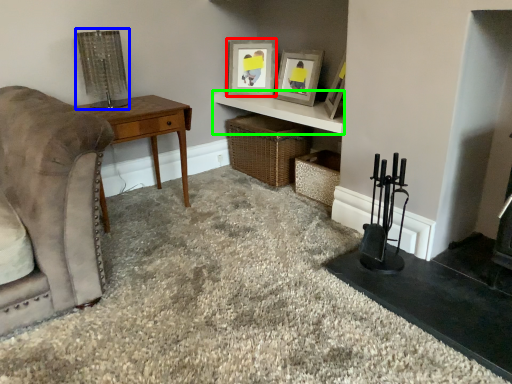
Question: Which object is positioned closest to picture frame (highlighted by a red box)? Select from lamp (highlighted by a blue box) and cabinetry (highlighted by a green box).

Choices:
 (A) lamp
 (B) cabinetry

Answer: (B)